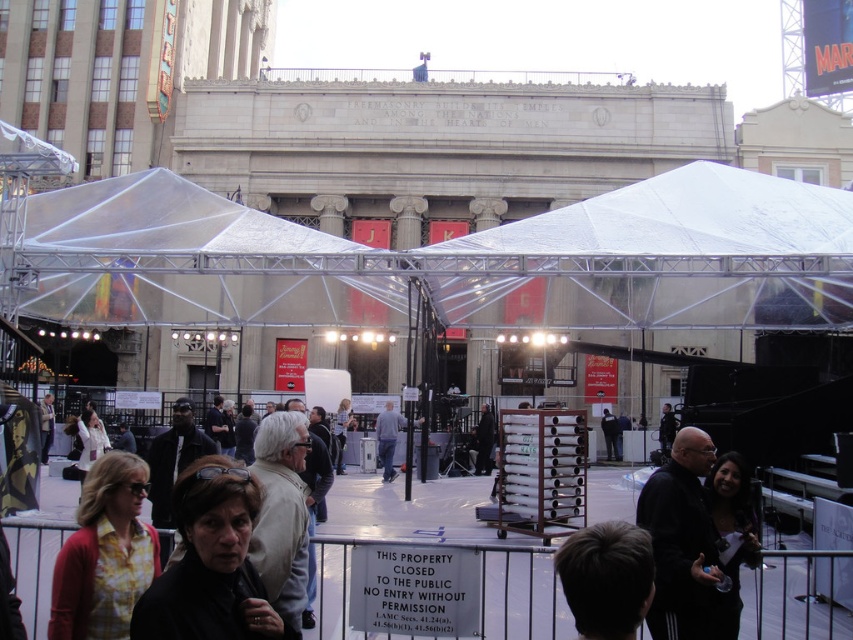
You are a security guard at the event and need to check the distance between the two jackets. You have a measuring tape that can extend up to 100 feet. Can you measure the distance between the matte black jacket at center and the black matte jacket at lower right without extending beyond your tape measure?

The distance between the matte black jacket at center and the black matte jacket at lower right is 108.29 feet, which exceeds the 100 feet limit of the measuring tape. Therefore, you cannot measure the full distance without extending beyond your tape measure.

You are a photographer trying to capture a clear shot of the dark brown hair at center without including the black matte jacket at lower right. Given their sizes, is this feasible?

The black matte jacket at lower right is larger in size than the dark brown hair at center, so it might block the view of the dark brown hair at center. You may need to adjust your angle to avoid including the jacket.